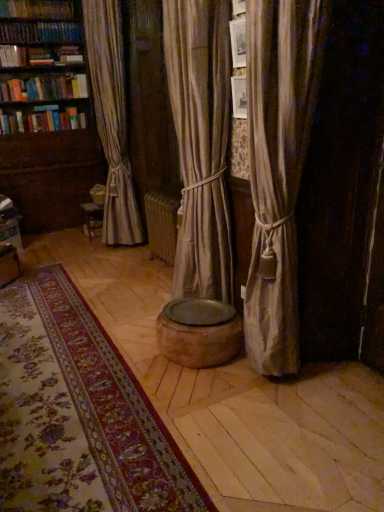
Question: Does wooden bookshelf at left appear on the left side of hardcover book at upper left?

Choices:
 (A) no
 (B) yes

Answer: (A)

Question: Can you confirm if wooden bookshelf at left is taller than hardcover book at upper left?

Choices:
 (A) yes
 (B) no

Answer: (A)

Question: From a real-world perspective, is wooden bookshelf at left physically above hardcover book at upper left?

Choices:
 (A) no
 (B) yes

Answer: (A)

Question: Can you confirm if wooden bookshelf at left is smaller than hardcover book at upper left?

Choices:
 (A) no
 (B) yes

Answer: (A)

Question: Is wooden bookshelf at left further to the viewer compared to hardcover book at upper left?

Choices:
 (A) yes
 (B) no

Answer: (B)

Question: Does point coord(26,53) appear closer or farther from the camera than point coord(296,6)?

Choices:
 (A) closer
 (B) farther

Answer: (B)

Question: From a real-world perspective, is hardcover book at upper left physically located above or below silky beige curtain at right?

Choices:
 (A) above
 (B) below

Answer: (A)

Question: Is hardcover book at upper left to the left or to the right of silky beige curtain at right in the image?

Choices:
 (A) left
 (B) right

Answer: (A)

Question: Is hardcover book at upper left situated inside silky beige curtain at right or outside?

Choices:
 (A) inside
 (B) outside

Answer: (B)

Question: Which is correct: floral carpet at center is inside hardcover book at upper left, or outside of it?

Choices:
 (A) outside
 (B) inside

Answer: (A)

Question: Considering the positions of floral carpet at center and hardcover book at upper left in the image, is floral carpet at center taller or shorter than hardcover book at upper left?

Choices:
 (A) tall
 (B) short

Answer: (B)

Question: Does point (39, 390) appear closer or farther from the camera than point (6, 48)?

Choices:
 (A) farther
 (B) closer

Answer: (B)

Question: Is floral carpet at center to the left or to the right of hardcover book at upper left in the image?

Choices:
 (A) right
 (B) left

Answer: (A)

Question: Would you say wooden bookshelf at left is to the left or to the right of floral carpet at center in the picture?

Choices:
 (A) left
 (B) right

Answer: (A)

Question: In terms of height, does wooden bookshelf at left look taller or shorter compared to floral carpet at center?

Choices:
 (A) tall
 (B) short

Answer: (A)